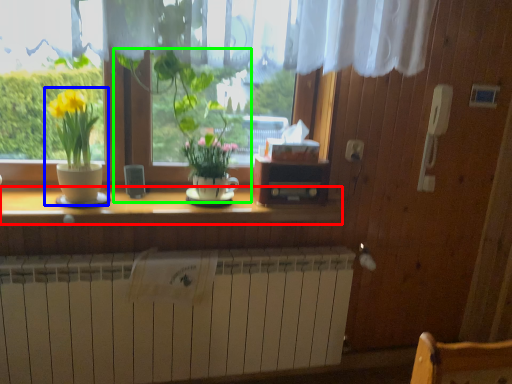
Question: Estimate the real-world distances between objects in this image. Which object is farther from counter top (highlighted by a red box), houseplant (highlighted by a blue box) or houseplant (highlighted by a green box)?

Choices:
 (A) houseplant
 (B) houseplant

Answer: (B)